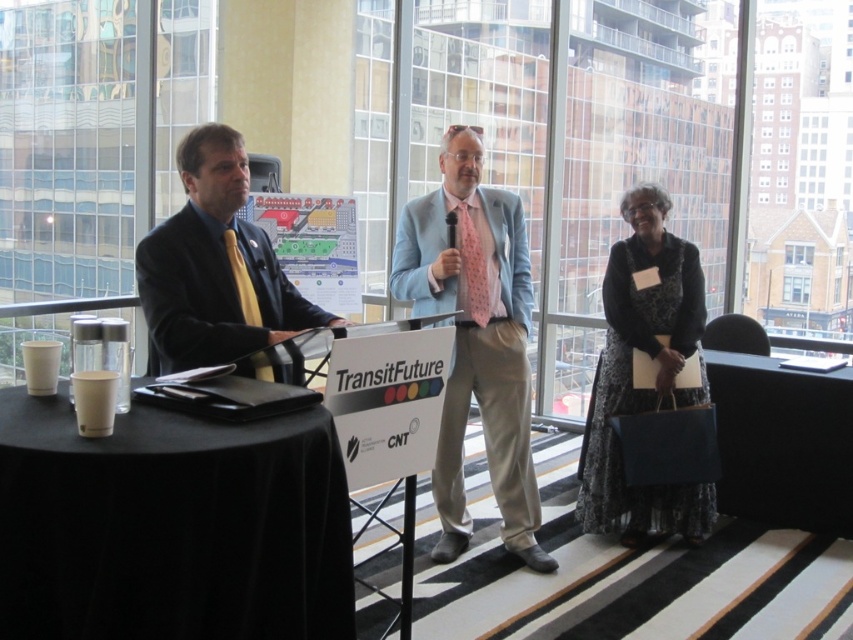
Question: Where is floral-patterned dress at right located in relation to black fabric table at lower right in the image?

Choices:
 (A) above
 (B) below

Answer: (A)

Question: Which is nearer to the floral-patterned dress at right?

Choices:
 (A) matte black suit at left
 (B) black fabric table at lower right

Answer: (B)

Question: Can you confirm if floral-patterned dress at right is positioned below matte black suit at left?

Choices:
 (A) yes
 (B) no

Answer: (A)

Question: Among these objects, which one is farthest from the camera?

Choices:
 (A) light blue fabric suit at center
 (B) matte black suit at left
 (C) black fabric table at lower right

Answer: (C)

Question: Which object is the farthest from the black fabric table at lower right?

Choices:
 (A) black fabric table at lower left
 (B) floral-patterned dress at right

Answer: (A)

Question: Is black fabric table at lower left bigger than matte black suit at left?

Choices:
 (A) yes
 (B) no

Answer: (A)